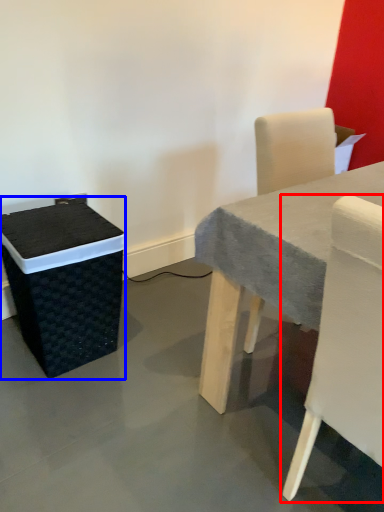
Question: Which object appears closest to the camera in this image, chair (highlighted by a red box) or storage box (highlighted by a blue box)?

Choices:
 (A) chair
 (B) storage box

Answer: (A)